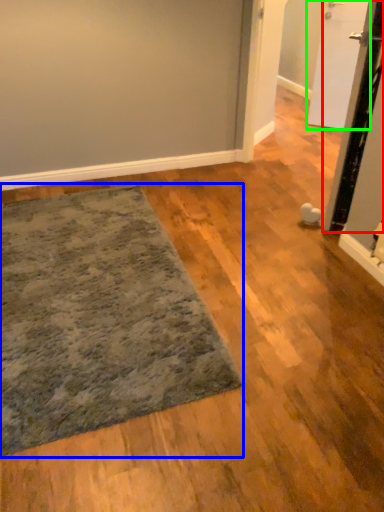
Question: Estimate the real-world distances between objects in this image. Which object is farther from door (highlighted by a red box), mat (highlighted by a blue box) or door (highlighted by a green box)?

Choices:
 (A) mat
 (B) door

Answer: (B)